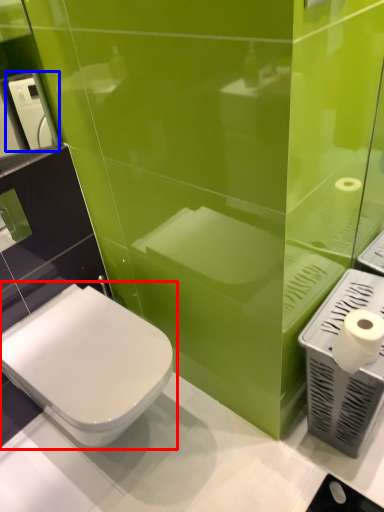
Question: Which of the following is the farthest to the observer, toilet (highlighted by a red box) or hand dryer (highlighted by a blue box)?

Choices:
 (A) toilet
 (B) hand dryer

Answer: (B)